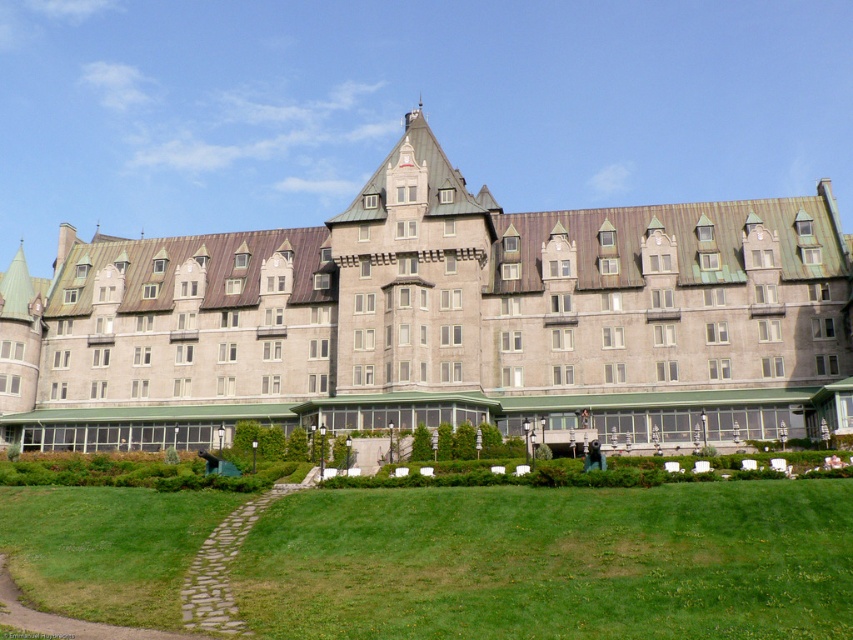
Based on the photo, you are standing on the green grass at lower center and want to reach the gray stone building at center. Which direction should you walk to move towards it?

Since the gray stone building at center is above the green grass at lower center, you should walk upwards or towards the higher elevation to reach it.

You are standing on the green grass at lower center looking up at the gray stone building at center. Which object is taller?

The gray stone building at center is taller than the green grass at lower center.

You are standing on the green grass at lower center and want to walk to the gray stone building at center. Which direction should you move to get closer to the building?

Since the gray stone building at center is further to the viewer than the green grass at lower center, you should move backward to get closer to the building.